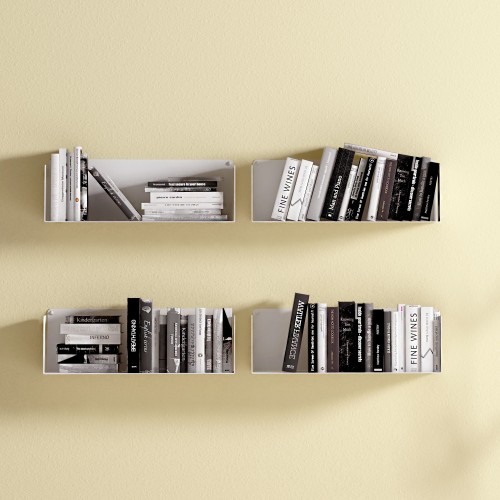
Locate an element on the screen. The height and width of the screenshot is (500, 500). shelf is located at coordinates (128, 177), (47, 334), (270, 335), (265, 181).